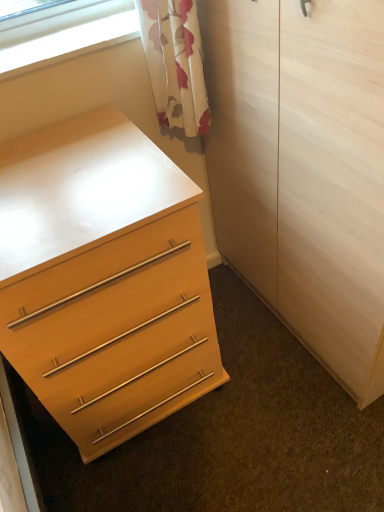
Question: Is point click(x=182, y=264) positioned closer to the camera than point click(x=306, y=135)?

Choices:
 (A) closer
 (B) farther

Answer: (B)

Question: Considering the positions of matte wood chest of drawers at lower left and light wood/texture armoire at center in the image, is matte wood chest of drawers at lower left taller or shorter than light wood/texture armoire at center?

Choices:
 (A) tall
 (B) short

Answer: (B)

Question: Which is farther from the light wood/texture armoire at center?

Choices:
 (A) clear glass window at upper left
 (B) matte wood chest of drawers at lower left

Answer: (A)

Question: Which object is the closest to the clear glass window at upper left?

Choices:
 (A) matte wood chest of drawers at lower left
 (B) light wood/texture armoire at center

Answer: (A)